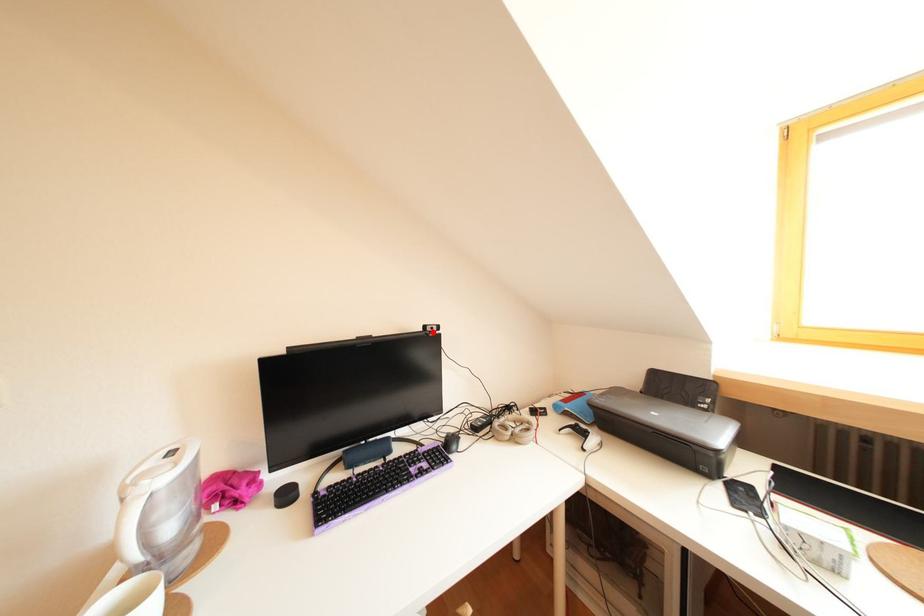
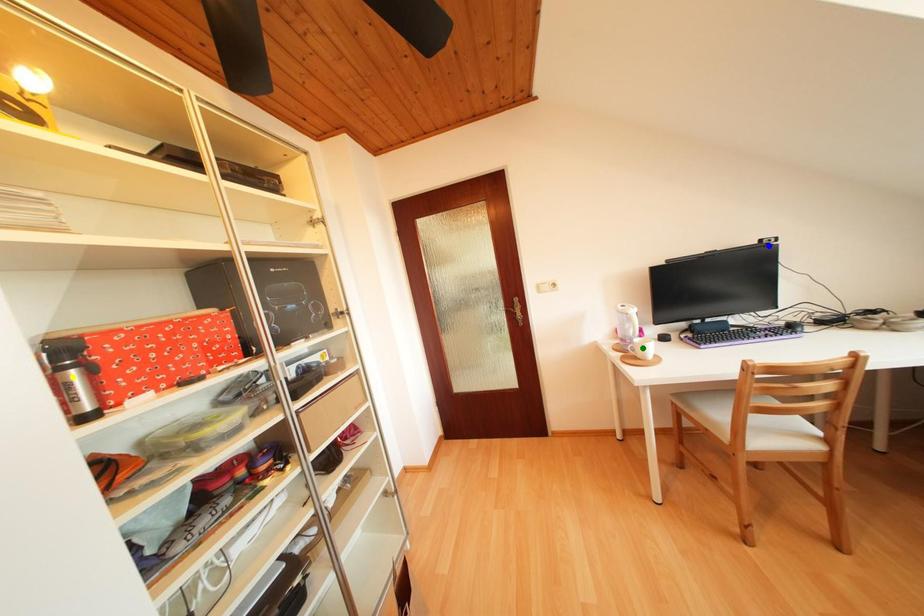
Question: I am providing you with two images of the same scene from different viewpoints. A red point is marked on the first image. You are given multiple points on the second image. Which point in image 2 is actually the same real-world point as the red point in image 1?

Choices:
 (A) green point
 (B) blue point
 (C) yellow point

Answer: (B)